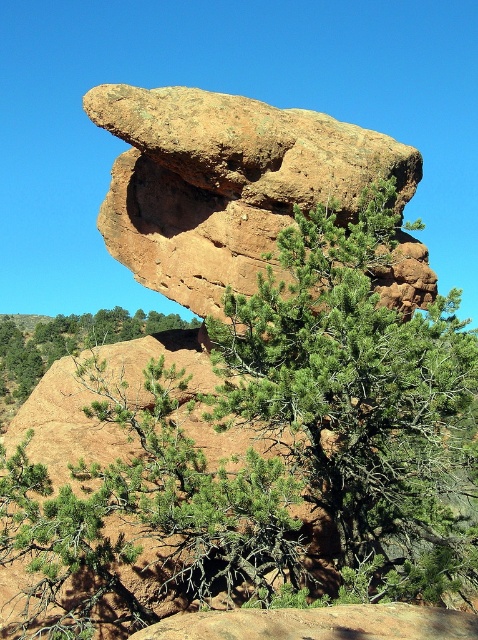
Question: Considering the relative positions of green needle-like tree at center and rustic stone boulder at center in the image provided, where is green needle-like tree at center located with respect to rustic stone boulder at center?

Choices:
 (A) right
 (B) left

Answer: (A)

Question: Which point is closer to the camera taking this photo?

Choices:
 (A) (326, 268)
 (B) (161, 241)

Answer: (A)

Question: Is green needle-like tree at center above rustic stone boulder at center?

Choices:
 (A) no
 (B) yes

Answer: (A)

Question: Is green needle-like tree at center thinner than rustic stone boulder at center?

Choices:
 (A) yes
 (B) no

Answer: (A)